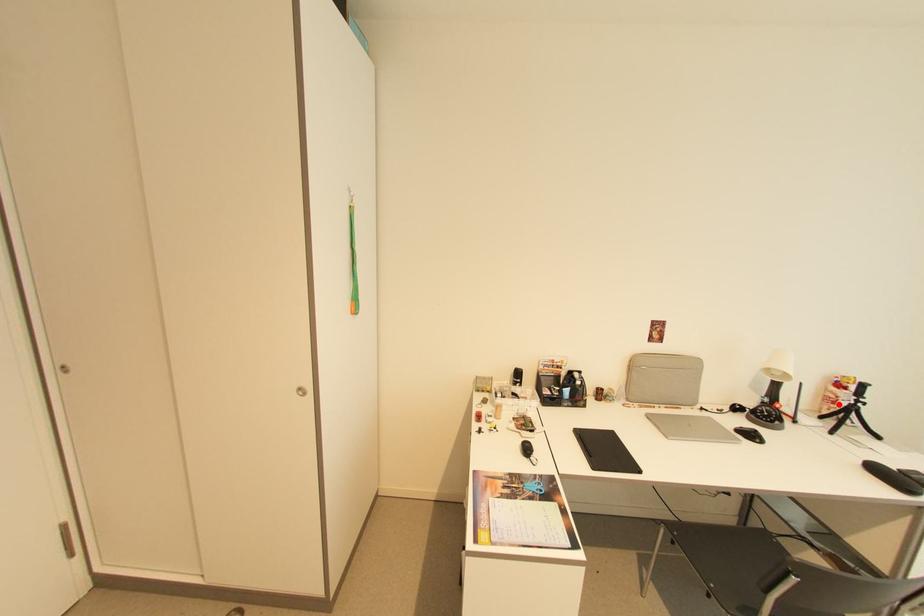
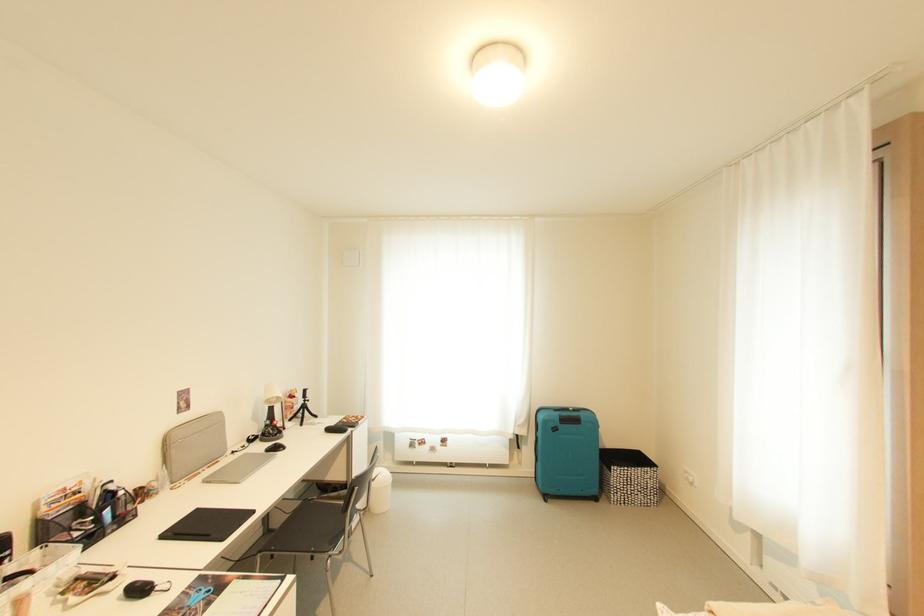
In the second image, find the point that corresponds to the highlighted location in the first image.

(297, 410)